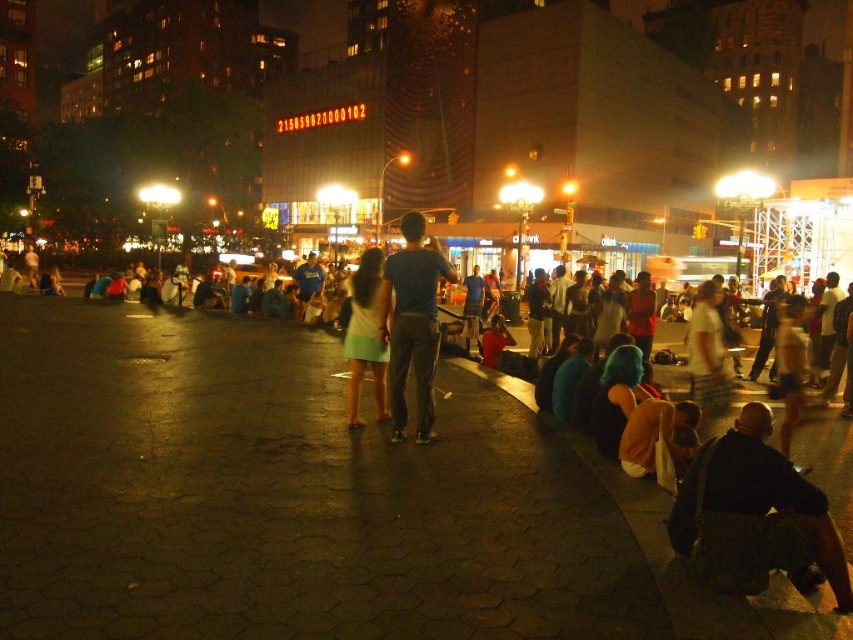
Question: Can you confirm if dark blue jeans at center is thinner than light green fabric dress at center?

Choices:
 (A) yes
 (B) no

Answer: (A)

Question: Does dark blue jeans at center appear on the left side of light green fabric dress at center?

Choices:
 (A) no
 (B) yes

Answer: (A)

Question: Is dark blue jeans at center to the left of light green fabric dress at center from the viewer's perspective?

Choices:
 (A) yes
 (B) no

Answer: (B)

Question: Which point is farther from the camera taking this photo?

Choices:
 (A) (427, 333)
 (B) (376, 253)

Answer: (B)